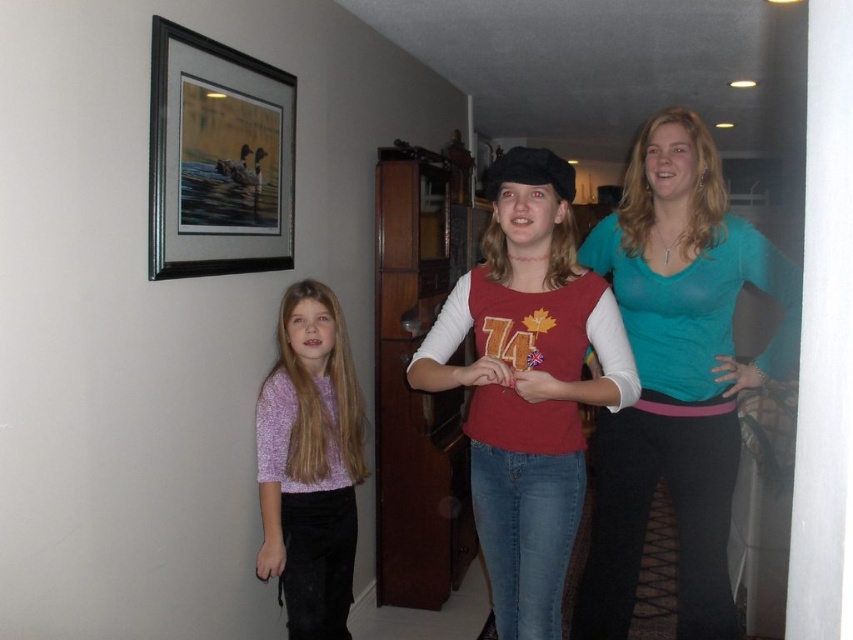
You are a photographer setting up for a group photo. You want to ensure the matte red shirt at center and the purple knit sweater at left are both visible in the frame. Based on their positions, which one is closer to the camera?

The matte red shirt at center is in front of the purple knit sweater at left, so it is closer to the camera.

You are standing in the hallway and want to hang a new painting that is 1.2 meters wide. The existing black framed picture at upper left is located at coordinates point (218,157). Can you determine if there is enough space to hang the new painting next to the black framed picture at upper left?

The point (218,157) corresponds to the black framed picture at upper left, but without knowing the spacing between objects or the total available wall space, it is impossible to determine if there is enough room to hang the new painting next to it.

You are a photographer adjusting your camera settings to focus on the black framed picture at upper left and the purple knit sweater at left. Which object should you focus on first to ensure it appears sharp in the foreground?

The black framed picture at upper left should be focused on first because it is in front of the purple knit sweater at left, making it closer to the camera and thus the foreground element.